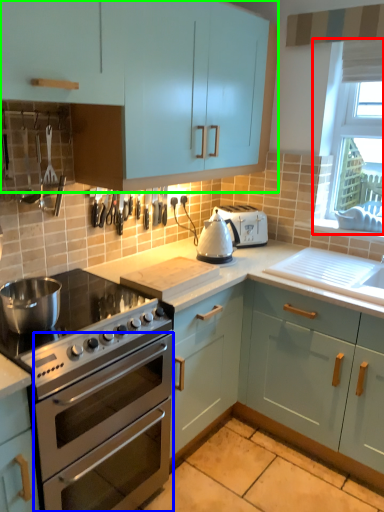
Question: Estimate the real-world distances between objects in this image. Which object is farther from window screen (highlighted by a red box), oven (highlighted by a blue box) or cabinetry (highlighted by a green box)?

Choices:
 (A) oven
 (B) cabinetry

Answer: (A)